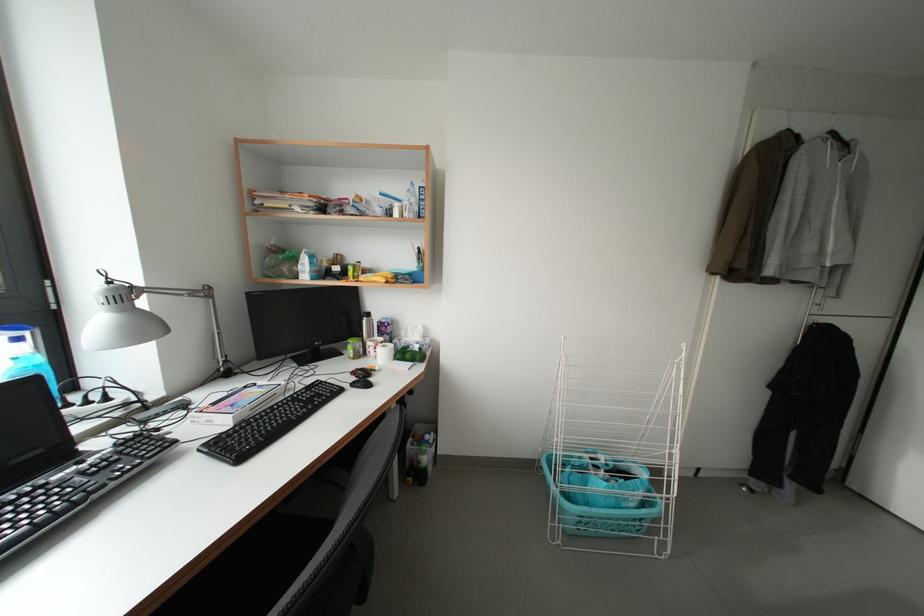
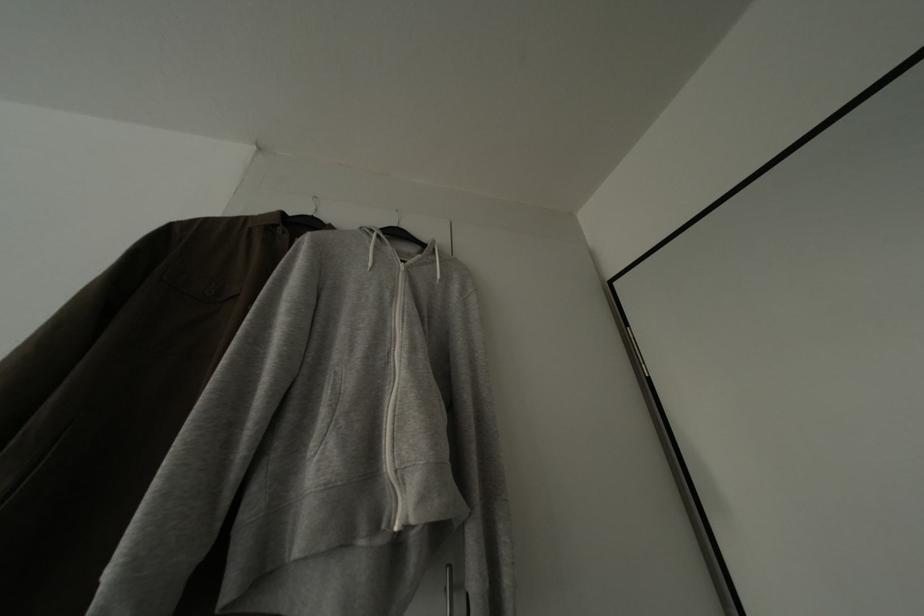
Where in the second image is the point corresponding to (853,150) from the first image?

(431, 252)